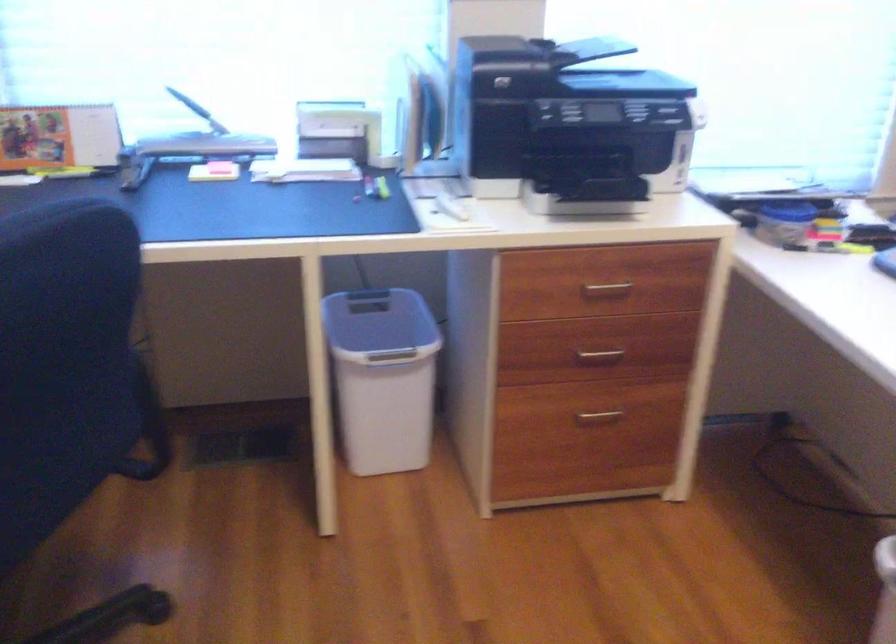
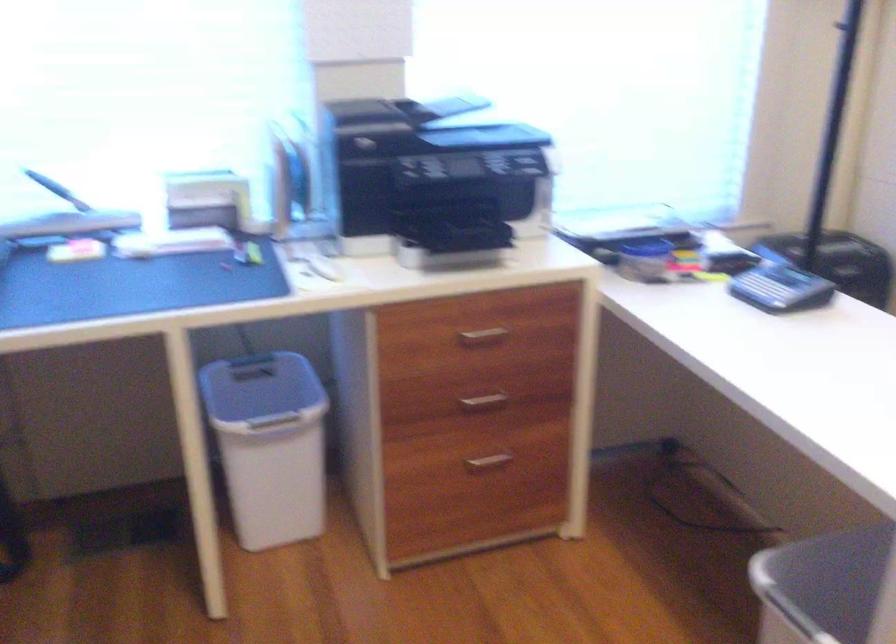
Locate, in the second image, the point that corresponds to pixel 373 324 in the first image.

(261, 390)